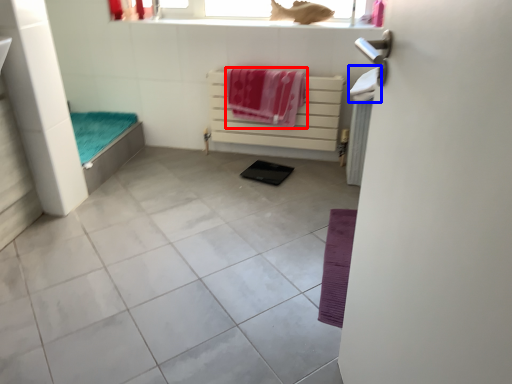
Question: Which of the following is the closest to the observer, beach towel (highlighted by a red box) or beach towel (highlighted by a blue box)?

Choices:
 (A) beach towel
 (B) beach towel

Answer: (B)